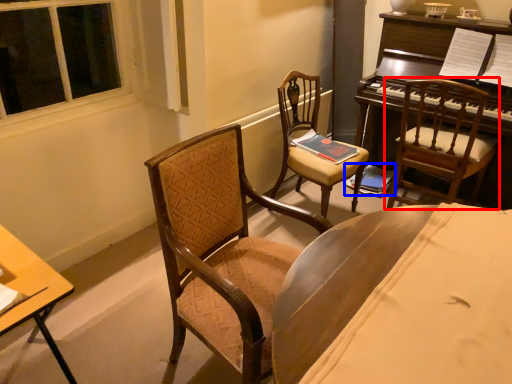
Question: Which object appears farthest to the camera in this image, chair (highlighted by a red box) or book (highlighted by a blue box)?

Choices:
 (A) chair
 (B) book

Answer: (B)